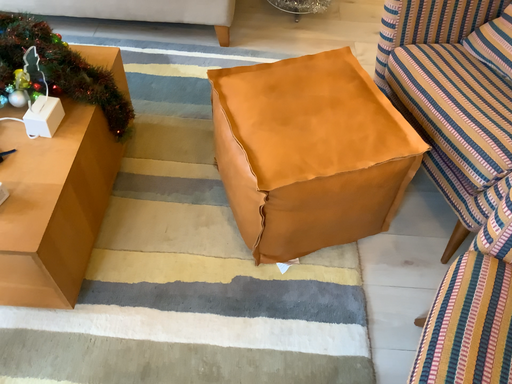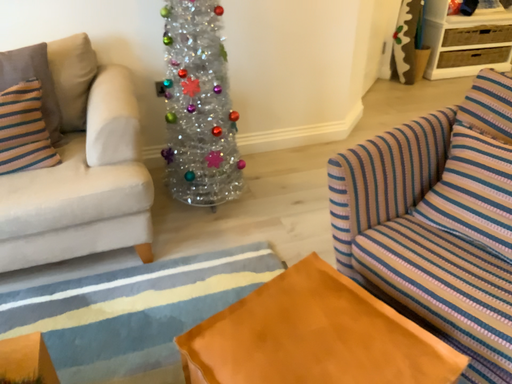
Question: Which way did the camera rotate in the video?

Choices:
 (A) rotated downward
 (B) rotated upward

Answer: (B)